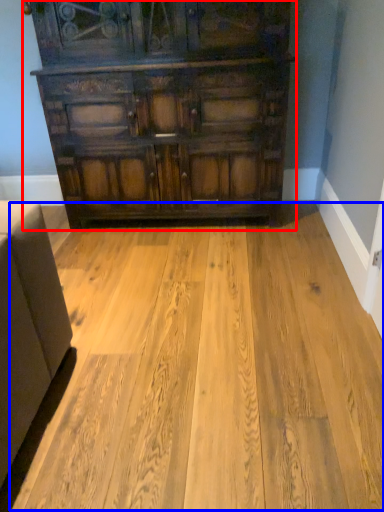
Question: Among these objects, which one is farthest to the camera, chest of drawers (highlighted by a red box) or plywood (highlighted by a blue box)?

Choices:
 (A) chest of drawers
 (B) plywood

Answer: (A)